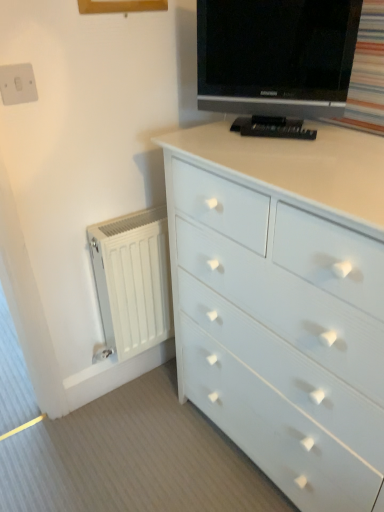
Question: From the image's perspective, is white plastic switch at upper left located above or below black glossy tv at upper center?

Choices:
 (A) above
 (B) below

Answer: (B)

Question: From a real-world perspective, is white plastic switch at upper left physically located above or below black glossy tv at upper center?

Choices:
 (A) below
 (B) above

Answer: (A)

Question: Which is nearer to the black glossy tv at upper center?

Choices:
 (A) white matte radiator at left
 (B) white painted wood chest of drawers at center
 (C) white plastic switch at upper left

Answer: (B)

Question: Which object is the farthest from the black glossy tv at upper center?

Choices:
 (A) white painted wood chest of drawers at center
 (B) white matte radiator at left
 (C) white plastic switch at upper left

Answer: (C)